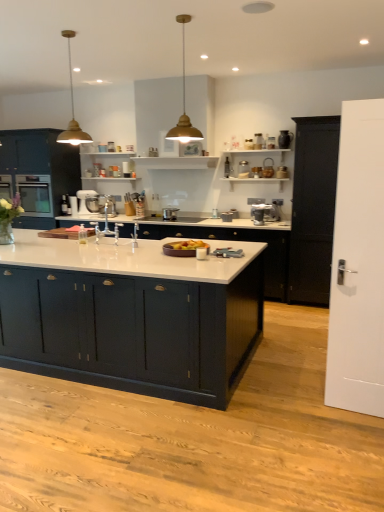
Locate an element on the screen. Image resolution: width=384 pixels, height=512 pixels. empty space that is ontop of gold metal pendant light at upper center, acting as the second light fixture starting from the right (from a real-world perspective) is located at coordinates (66, 32).